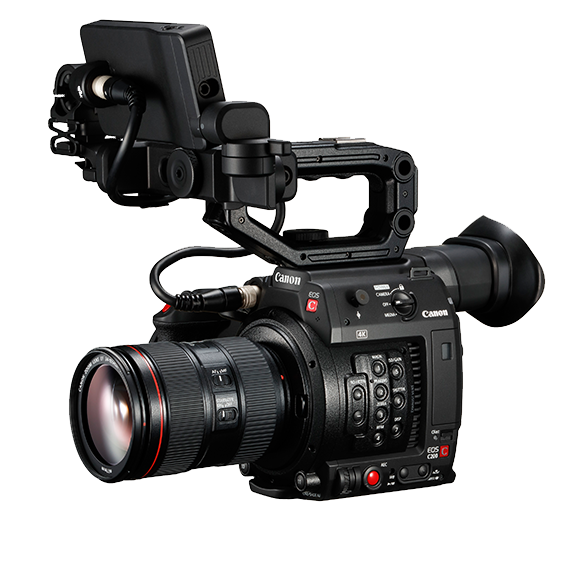
You are a GUI agent. You are given a task and a screenshot of the screen. Output one action in this format:
    pyautogui.click(x=<x>, y=<y>)
    Task: Click on the cable wire connectors
    The image size is (580, 580).
    Given the screenshot: What is the action you would take?
    pyautogui.click(x=100, y=86), pyautogui.click(x=245, y=296)